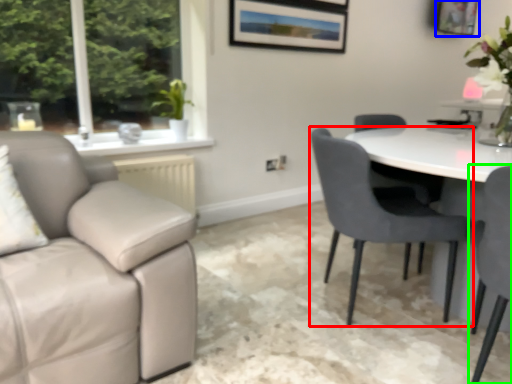
Question: Estimate the real-world distances between objects in this image. Which object is closer to chair (highlighted by a red box), picture frame (highlighted by a blue box) or chair (highlighted by a green box)?

Choices:
 (A) picture frame
 (B) chair

Answer: (B)